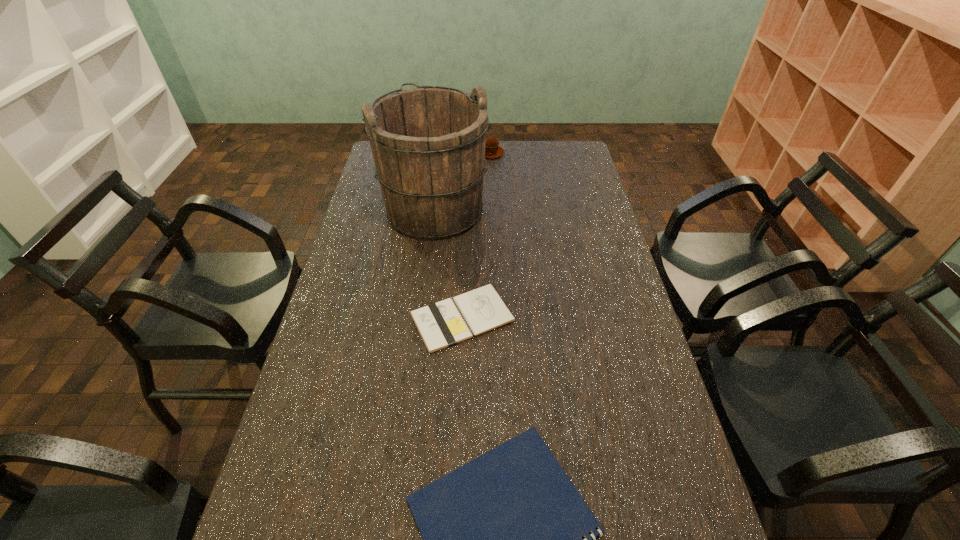
Where is `vacant space at the far edge of the desktop`? Image resolution: width=960 pixels, height=540 pixels. vacant space at the far edge of the desktop is located at coordinates (532, 143).

In the image, there is a desktop. Where is `free space at the left edge`? free space at the left edge is located at coordinates (348, 310).

Identify the location of free point at the right edge. This screenshot has height=540, width=960. (614, 366).

Identify the location of vacant region between the second farthest object and the farther notepad. pyautogui.click(x=448, y=264).

I want to click on empty space between the farther notepad and the tallest object, so click(448, 264).

This screenshot has height=540, width=960. I want to click on empty location between the farthest object and the second nearest object, so coord(476,235).

Select which object is the closest to the second nearest object. Please provide its 2D coordinates. Your answer should be formatted as a tuple, i.e. [(x, y)], where the tuple contains the x and y coordinates of a point satisfying the conditions above.

[(428, 143)]

Select which object appears as the closest to the farthest object. Please provide its 2D coordinates. Your answer should be formatted as a tuple, i.e. [(x, y)], where the tuple contains the x and y coordinates of a point satisfying the conditions above.

[(428, 143)]

The height and width of the screenshot is (540, 960). In order to click on vacant space that satisfies the following two spatial constraints: 1. on the front side of the second nearest object; 2. on the right side of the bucket in this screenshot , I will do (422, 318).